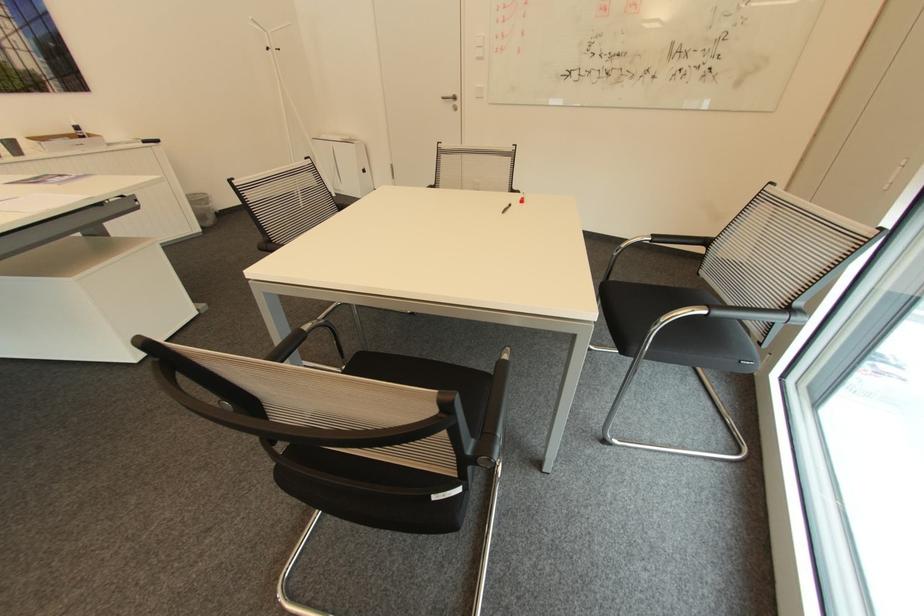
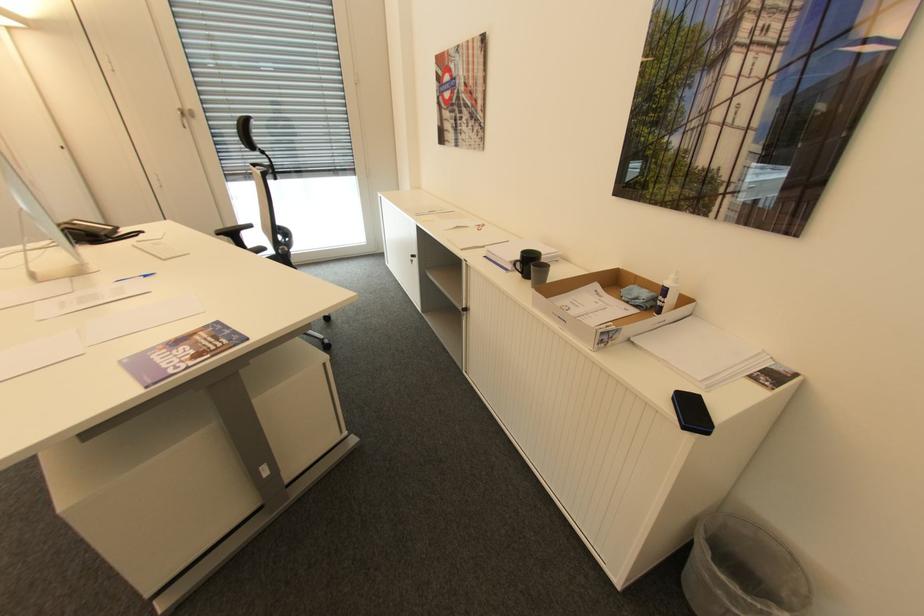
In the second image, find the point that corresponds to the point at 81,128 in the first image.

(670, 291)